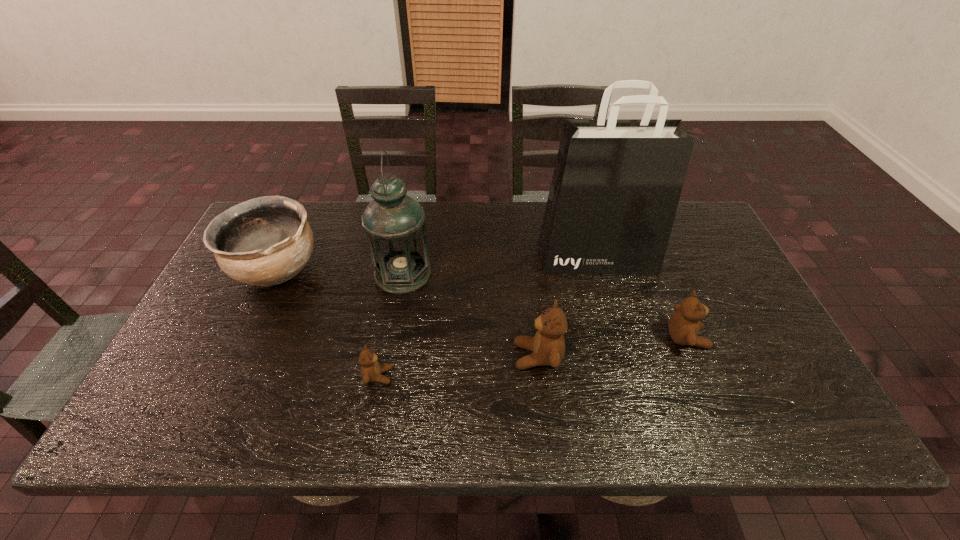
Where is `free area in between the tallest object and the rightmost teddy bear`? free area in between the tallest object and the rightmost teddy bear is located at coordinates (642, 298).

I want to click on free space between the tallest object and the pottery, so click(437, 263).

Find the location of a particular element. free spot between the second tallest object and the second teddy bear from right to left is located at coordinates (470, 315).

You are a GUI agent. You are given a task and a screenshot of the screen. Output one action in this format:
    pyautogui.click(x=<x>, y=<y>)
    Task: Click on the free point between the second tallest teddy bear and the tallest object
    This screenshot has height=540, width=960.
    Given the screenshot: What is the action you would take?
    pyautogui.click(x=642, y=298)

This screenshot has width=960, height=540. I want to click on empty space between the leftmost object and the second tallest object, so click(x=340, y=272).

Select which object appears as the second closest to the leftmost object. Please provide its 2D coordinates. Your answer should be formatted as a tuple, i.e. [(x, y)], where the tuple contains the x and y coordinates of a point satisfying the conditions above.

[(371, 370)]

The width and height of the screenshot is (960, 540). In order to click on object that stands as the third closest to the second shortest teddy bear in this screenshot , I will do `click(394, 223)`.

This screenshot has width=960, height=540. Find the location of `teddy bear that is the third closest to the leftmost object`. teddy bear that is the third closest to the leftmost object is located at coordinates (684, 325).

Choose which teddy bear is the second nearest neighbor to the pottery. Please provide its 2D coordinates. Your answer should be formatted as a tuple, i.e. [(x, y)], where the tuple contains the x and y coordinates of a point satisfying the conditions above.

[(547, 346)]